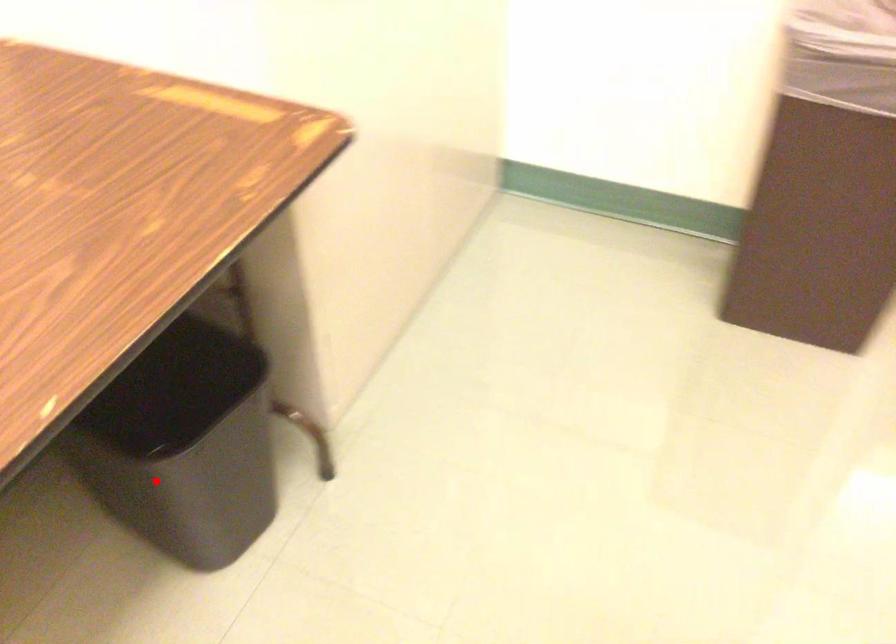
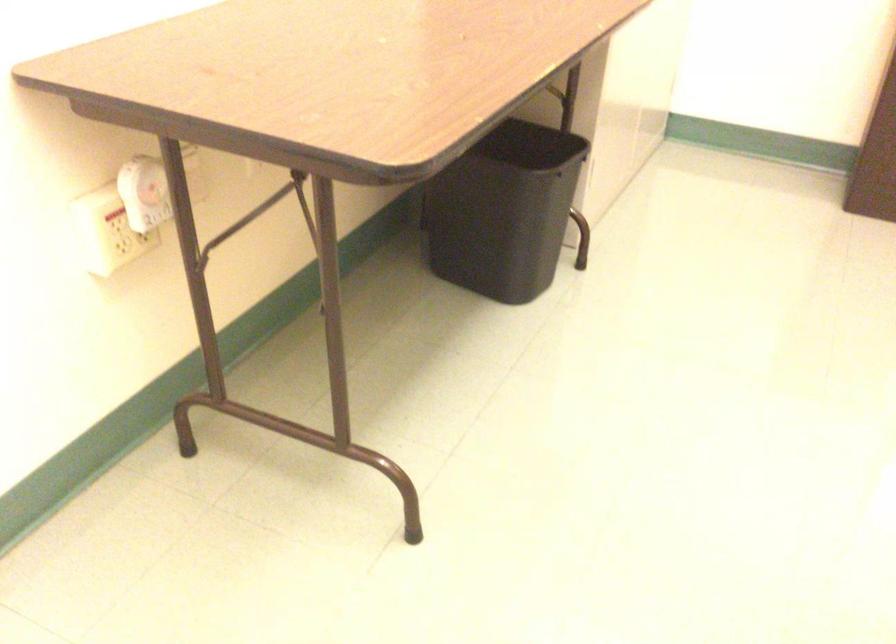
In the second image, find the point that corresponds to the highlighted location in the first image.

(504, 211)